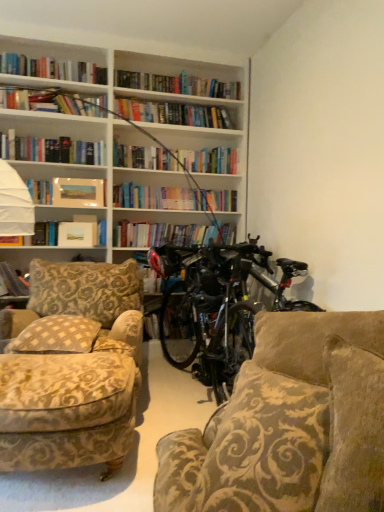
Question: Should I look upward or downward to see matte paper photo frame at upper left, the 1th book when ordered from right to left?

Choices:
 (A) down
 (B) up

Answer: (B)

Question: From a real-world perspective, is matte paper photo frame at upper left, the 1th book when ordered from right to left, on hardcover book at left, which appears as the 2th book when viewed from the right?

Choices:
 (A) yes
 (B) no

Answer: (A)

Question: Does matte paper photo frame at upper left, the 1th book when ordered from right to left, touch hardcover book at left, which ranks as the 1th book in bottom-to-top order?

Choices:
 (A) no
 (B) yes

Answer: (A)

Question: From the image's perspective, does matte paper photo frame at upper left, which is the 1th book in top-to-bottom order, appear lower than hardcover book at left, the first book in the left-to-right sequence?

Choices:
 (A) yes
 (B) no

Answer: (B)

Question: Would you say hardcover book at left, marked as the second book in a top-to-bottom arrangement, is part of matte paper photo frame at upper left, the 1th book when ordered from right to left,'s contents?

Choices:
 (A) no
 (B) yes

Answer: (A)

Question: From a real-world perspective, is matte paper photo frame at upper left, the 2th book in the bottom-to-top sequence, below hardcover book at left, which ranks as the 1th book in bottom-to-top order?

Choices:
 (A) no
 (B) yes

Answer: (A)

Question: From the image's perspective, does matte paper photo frame at upper left, placed as the 2th book when sorted from left to right, appear higher than hardcover book at left, which ranks as the 1th book in bottom-to-top order?

Choices:
 (A) no
 (B) yes

Answer: (B)

Question: Can you confirm if matte paper paperback book at upper left is taller than shiny black bicycle at center?

Choices:
 (A) yes
 (B) no

Answer: (B)

Question: Is matte paper paperback book at upper left aimed at shiny black bicycle at center?

Choices:
 (A) no
 (B) yes

Answer: (A)

Question: From a real-world perspective, is matte paper paperback book at upper left physically above shiny black bicycle at center?

Choices:
 (A) no
 (B) yes

Answer: (B)

Question: Is matte paper paperback book at upper left thinner than shiny black bicycle at center?

Choices:
 (A) no
 (B) yes

Answer: (B)

Question: Is shiny black bicycle at center a part of matte paper paperback book at upper left?

Choices:
 (A) no
 (B) yes

Answer: (A)

Question: Is there a large distance between matte paper paperback book at upper left and shiny black bicycle at center?

Choices:
 (A) yes
 (B) no

Answer: (A)

Question: From the image's perspective, would you say matte paper photo frame at upper left, the 1th book when ordered from right to left, is positioned over matte paper paperback book at upper left?

Choices:
 (A) no
 (B) yes

Answer: (B)